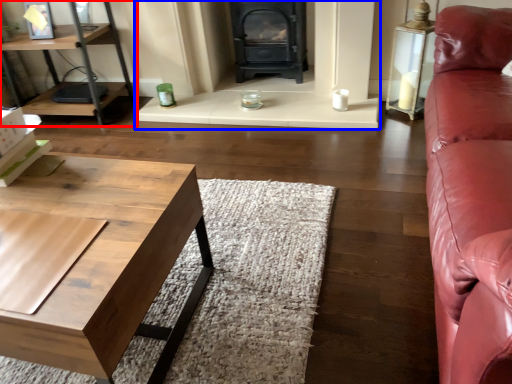
Question: Which point is closer to the camera, shelf (highlighted by a red box) or fireplace (highlighted by a blue box)?

Choices:
 (A) shelf
 (B) fireplace

Answer: (B)